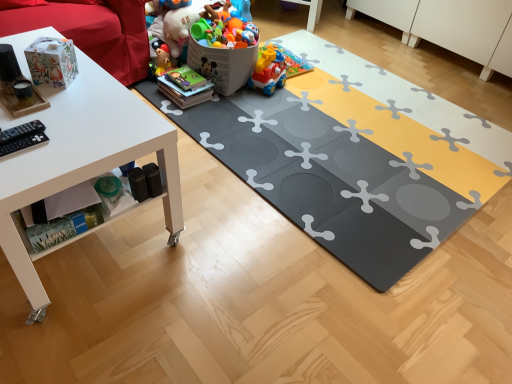
Question: Visually, is plastic multicolored toy train at center, arranged as the 1th toy when viewed from the back, positioned to the left or to the right of white matte table at left?

Choices:
 (A) right
 (B) left

Answer: (A)

Question: Considering the positions of plastic multicolored toy train at center, arranged as the 1th toy when viewed from the back, and white matte table at left in the image, is plastic multicolored toy train at center, arranged as the 1th toy when viewed from the back, bigger or smaller than white matte table at left?

Choices:
 (A) big
 (B) small

Answer: (B)

Question: Which is nearer to the white matte table at left?

Choices:
 (A) gray rubber yoga mat at center
 (B) plastic multicolored toy train at center, the 4th toy in the front-to-back sequence
 (C) plastic toy at center, the third toy viewed from the back
 (D) matte paper bag at upper left, which appears as the 1th toy when viewed from the front
 (E) plastic toy at upper center, the second toy positioned from the back

Answer: (D)

Question: Estimate the real-world distances between objects in this image. Which object is closer to the plastic multicolored toy train at center, arranged as the 1th toy when viewed from the back?

Choices:
 (A) plastic toy at upper center, the second toy positioned from the back
 (B) matte paper bag at upper left, placed as the fourth toy when sorted from back to front
 (C) white matte table at left
 (D) plastic toy at center, the third toy viewed from the back
 (E) gray rubber yoga mat at center

Answer: (D)